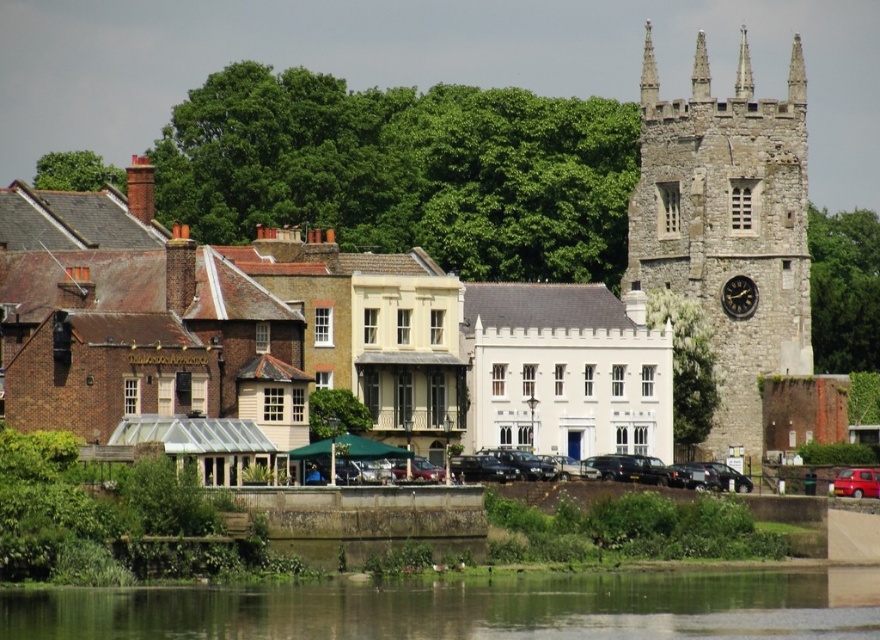
Who is taller, black metal clock at upper right or shiny red car at lower right?

black metal clock at upper right is taller.

Consider the image. Between black metal clock at upper right and shiny red car at lower right, which one is positioned higher?

black metal clock at upper right is above.

At what (x,y) coordinates should I click in order to perform the action: click on black metal clock at upper right. Please return your answer as a coordinate pair (x, y). The height and width of the screenshot is (640, 880). Looking at the image, I should click on (739, 296).

Is stone clock tower at right to the right of shiny red car at lower right from the viewer's perspective?

Incorrect, stone clock tower at right is not on the right side of shiny red car at lower right.

Who is lower down, stone clock tower at right or shiny red car at lower right?

shiny red car at lower right is below.

The width and height of the screenshot is (880, 640). I want to click on stone clock tower at right, so click(x=727, y=225).

Identify the location of green smooth water at lower center. The image size is (880, 640). (467, 609).

Does green smooth water at lower center appear over shiny red car at lower right?

Actually, green smooth water at lower center is below shiny red car at lower right.

Identify the location of green smooth water at lower center. This screenshot has width=880, height=640. (467, 609).